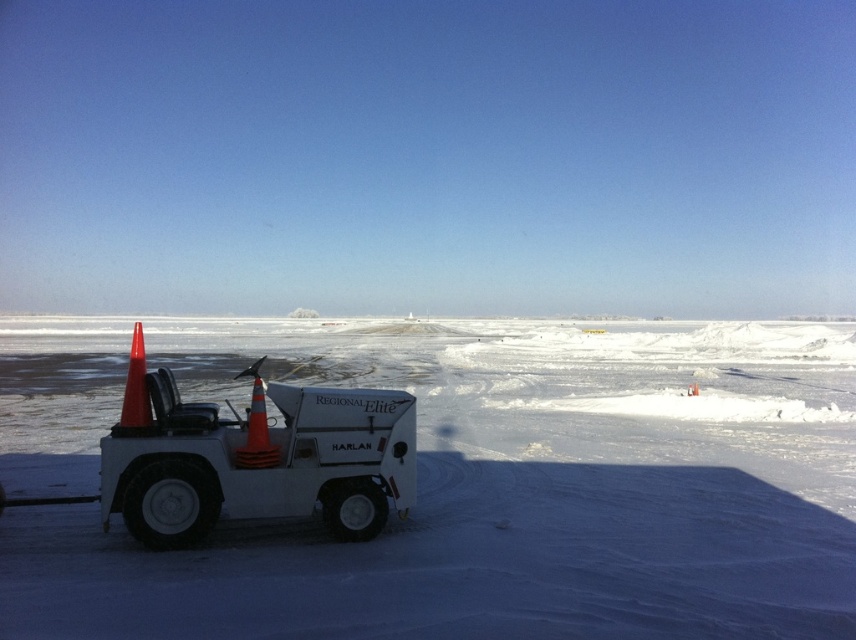
Is white powdery snow at lower left shorter than orange matte traffic cone at center?

Incorrect, white powdery snow at lower left's height does not fall short of orange matte traffic cone at center's.

Does white powdery snow at lower left appear on the right side of orange matte traffic cone at center?

No, white powdery snow at lower left is not to the right of orange matte traffic cone at center.

Is point (611, 611) more distant than point (694, 387)?

No, it is in front of (694, 387).

Find the location of `white powdery snow at lower left`. white powdery snow at lower left is located at coordinates tap(506, 493).

Between white matte snowplow at center and orange matte traffic cone at left, which one appears on the right side from the viewer's perspective?

white matte snowplow at center is more to the right.

Locate an element on the screen. This screenshot has width=856, height=640. white matte snowplow at center is located at coordinates (260, 461).

The width and height of the screenshot is (856, 640). I want to click on white matte snowplow at center, so click(260, 461).

In order to click on white matte snowplow at center in this screenshot , I will do `click(260, 461)`.

This screenshot has height=640, width=856. What do you see at coordinates (256, 433) in the screenshot?
I see `orange reflective cone at left` at bounding box center [256, 433].

Who is lower down, orange reflective cone at left or orange matte traffic cone at center?

orange matte traffic cone at center

The image size is (856, 640). What do you see at coordinates (256, 433) in the screenshot?
I see `orange reflective cone at left` at bounding box center [256, 433].

Find the location of a particular element. This screenshot has width=856, height=640. orange reflective cone at left is located at coordinates (256, 433).